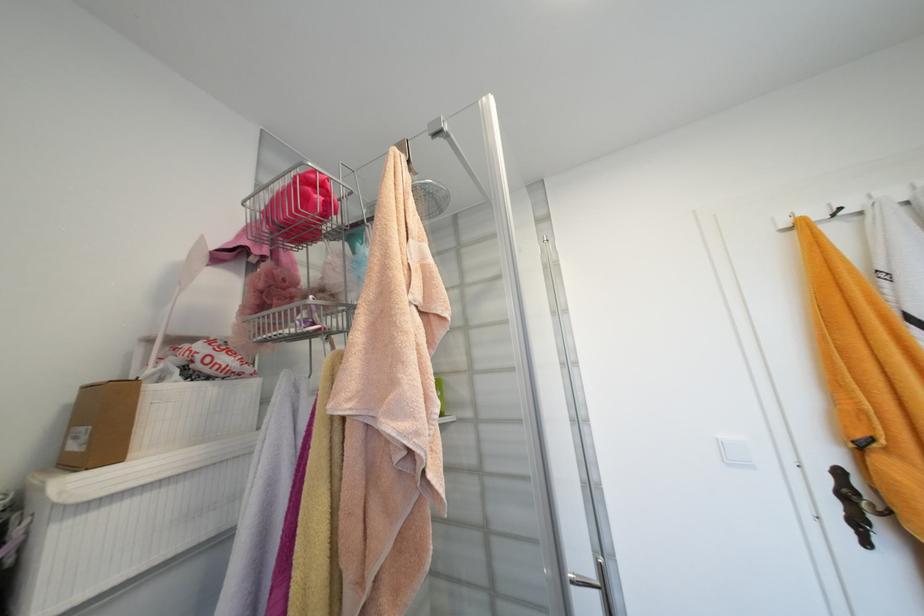
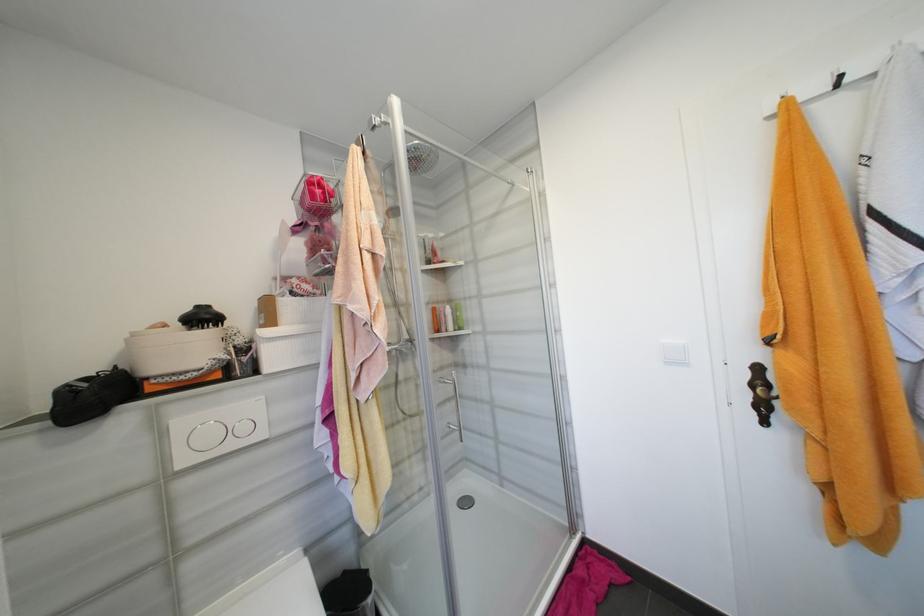
Question: The first image is from the beginning of the video and the second image is from the end. How did the camera likely rotate when shooting the video?

Choices:
 (A) Left
 (B) Right
 (C) Up
 (D) Down

Answer: (A)